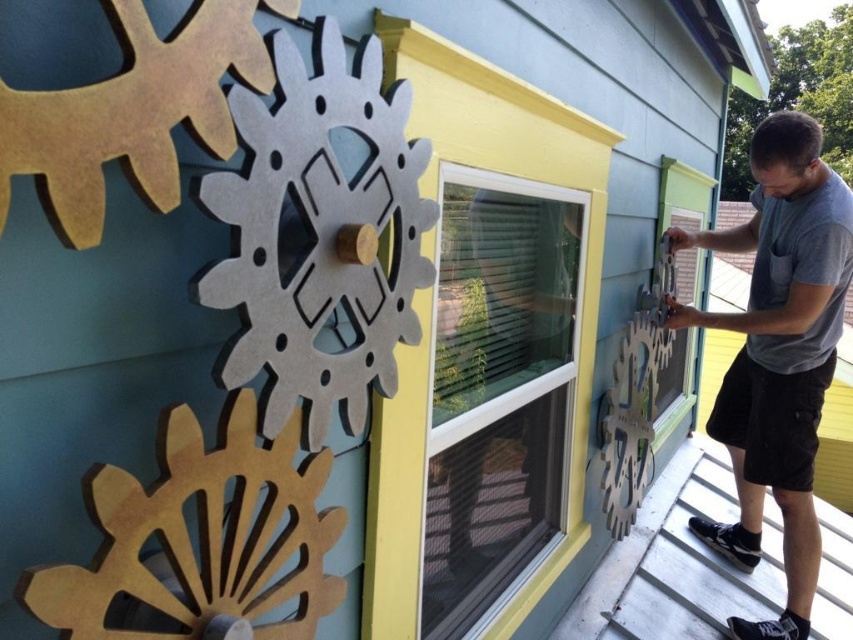
You are standing in front of the building and want to touch the two points on the gears. Which point, point (491, 262) or point (790, 516), will you reach first?

Point (491, 262) is closer to the viewer than point (790, 516), so you will reach point (491, 262) first.

You are a delivery person standing at the entrance of the building. You need to deliver a package to the yellow plastic window at center. The package is 1.5 meters long. Can you carry the package through the entrance without tilting it sideways?

The distance between the yellow plastic window at center and the viewer is 1.45 meters. Since the package is 1.5 meters long, it is slightly longer than the available space. Therefore, you cannot carry the package through the entrance without tilting it sideways.

You are a delivery person trying to deliver a package to the yellow plastic window at center. From your current position, which direction should you move to reach the window?

The yellow plastic window at center is located at point (498, 388), so you should move towards the center of the image to reach it.